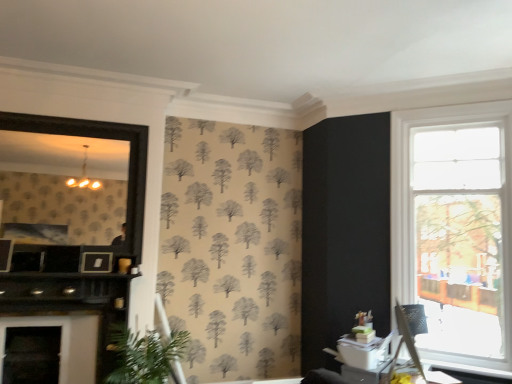
Question: Can you confirm if green leafy plant at lower left is positioned to the left of black matte fireplace at left?

Choices:
 (A) no
 (B) yes

Answer: (A)

Question: Considering the relative sizes of green leafy plant at lower left and black matte fireplace at left in the image provided, is green leafy plant at lower left smaller than black matte fireplace at left?

Choices:
 (A) no
 (B) yes

Answer: (A)

Question: From a real-world perspective, is green leafy plant at lower left located beneath black matte fireplace at left?

Choices:
 (A) yes
 (B) no

Answer: (A)

Question: Can you confirm if green leafy plant at lower left is thinner than black matte fireplace at left?

Choices:
 (A) no
 (B) yes

Answer: (A)

Question: Could you tell me if green leafy plant at lower left is turned towards black matte fireplace at left?

Choices:
 (A) yes
 (B) no

Answer: (B)

Question: Considering the positions of clear glass window at right and green leafy plant at lower left in the image, is clear glass window at right wider or thinner than green leafy plant at lower left?

Choices:
 (A) wide
 (B) thin

Answer: (B)

Question: Is clear glass window at right spatially inside green leafy plant at lower left, or outside of it?

Choices:
 (A) inside
 (B) outside

Answer: (B)

Question: From the image's perspective, relative to green leafy plant at lower left, is clear glass window at right above or below?

Choices:
 (A) above
 (B) below

Answer: (A)

Question: Based on their positions, is clear glass window at right located to the left or right of green leafy plant at lower left?

Choices:
 (A) right
 (B) left

Answer: (A)

Question: From a real-world perspective, relative to clear glass window at right, is matte black picture frame at upper left vertically above or below?

Choices:
 (A) above
 (B) below

Answer: (B)

Question: Is matte black picture frame at upper left taller or shorter than clear glass window at right?

Choices:
 (A) tall
 (B) short

Answer: (B)

Question: From the image's perspective, relative to clear glass window at right, is matte black picture frame at upper left above or below?

Choices:
 (A) below
 (B) above

Answer: (A)

Question: Considering the positions of point (82, 263) and point (406, 225), is point (82, 263) closer or farther from the camera than point (406, 225)?

Choices:
 (A) closer
 (B) farther

Answer: (A)

Question: Looking at their shapes, would you say green leafy plant at lower left is wider or thinner than black wooden frame at left?

Choices:
 (A) wide
 (B) thin

Answer: (A)

Question: Considering the positions of green leafy plant at lower left and black wooden frame at left in the image, is green leafy plant at lower left bigger or smaller than black wooden frame at left?

Choices:
 (A) big
 (B) small

Answer: (A)